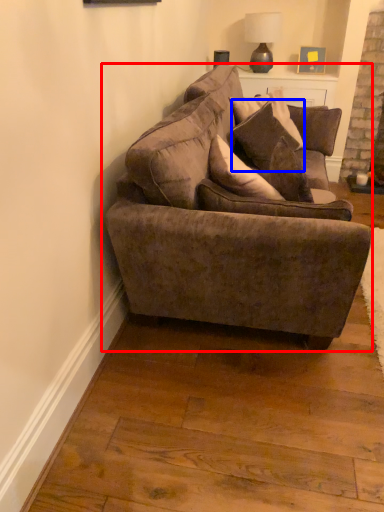
Question: Which of the following is the farthest to the observer, studio couch (highlighted by a red box) or pillow (highlighted by a blue box)?

Choices:
 (A) studio couch
 (B) pillow

Answer: (B)